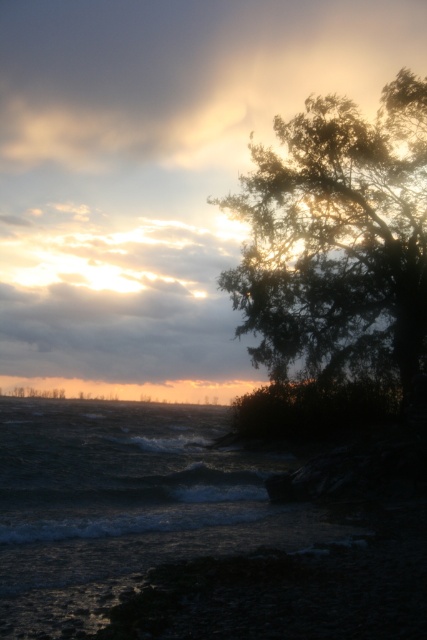
You are standing on the rocky shoreline and want to take a photo of the dark gray water at lower left and the silhouette leafy tree at upper right. Which object will appear smaller in your photo?

The dark gray water at lower left will appear smaller in your photo because it has a lesser height compared to the silhouette leafy tree at upper right.

You are standing at the shoreline and want to reach the silhouette leafy tree at upper right. Given that the dark gray water at lower left is between you and the tree, can you walk directly to the tree without crossing the water?

The distance between dark gray water at lower left and silhouette leafy tree at upper right is 43.82 feet. Since the water is between you and the tree, you would have to cross it to reach the tree.

You are standing on the rocky shoreline and want to take a photo of the silhouette leafy tree at upper right. To avoid capturing the dark gray water at lower left in your shot, should you adjust your camera to point more to the right or left?

You should point your camera more to the right to avoid capturing the dark gray water at lower left, as the dark gray water at lower left is located to the left of the silhouette leafy tree at upper right in the image.